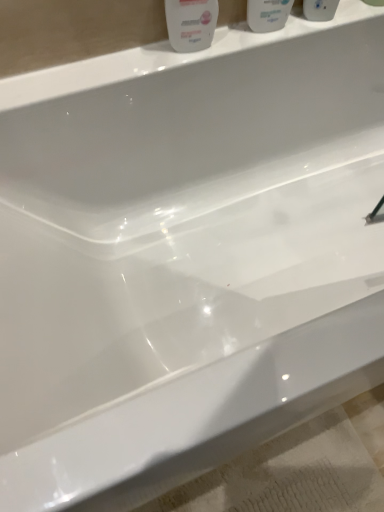
Question: Is white glossy mouthwash at upper center, marked as the second mouthwash in a right-to-left arrangement, bigger or smaller than white glossy mouthwash at upper center, positioned as the 2th mouthwash in left-to-right order?

Choices:
 (A) big
 (B) small

Answer: (A)

Question: From a real-world perspective, is white glossy mouthwash at upper center, the 1th mouthwash in the left-to-right sequence, positioned above or below white glossy mouthwash at upper center, positioned as the 2th mouthwash in left-to-right order?

Choices:
 (A) above
 (B) below

Answer: (B)

Question: Estimate the real-world distances between objects in this image. Which object is farther from the white glossy mouthwash at upper center, the 1th mouthwash in the left-to-right sequence?

Choices:
 (A) white glossy mouthwash at upper center, positioned as the 2th mouthwash in left-to-right order
 (B) white glossy bottle at upper center

Answer: (A)

Question: Which object is positioned farthest from the white glossy mouthwash at upper center, positioned as the 2th mouthwash in left-to-right order?

Choices:
 (A) white glossy mouthwash at upper center, the 1th mouthwash in the left-to-right sequence
 (B) white glossy bottle at upper center

Answer: (B)